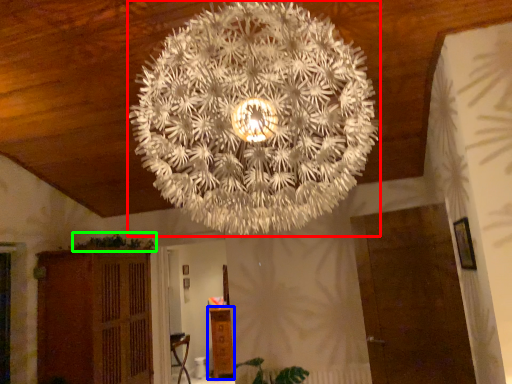
Question: Estimate the real-world distances between objects in this image. Which object is farther from lamp (highlighted by a red box), furniture (highlighted by a blue box) or plant (highlighted by a green box)?

Choices:
 (A) furniture
 (B) plant

Answer: (A)